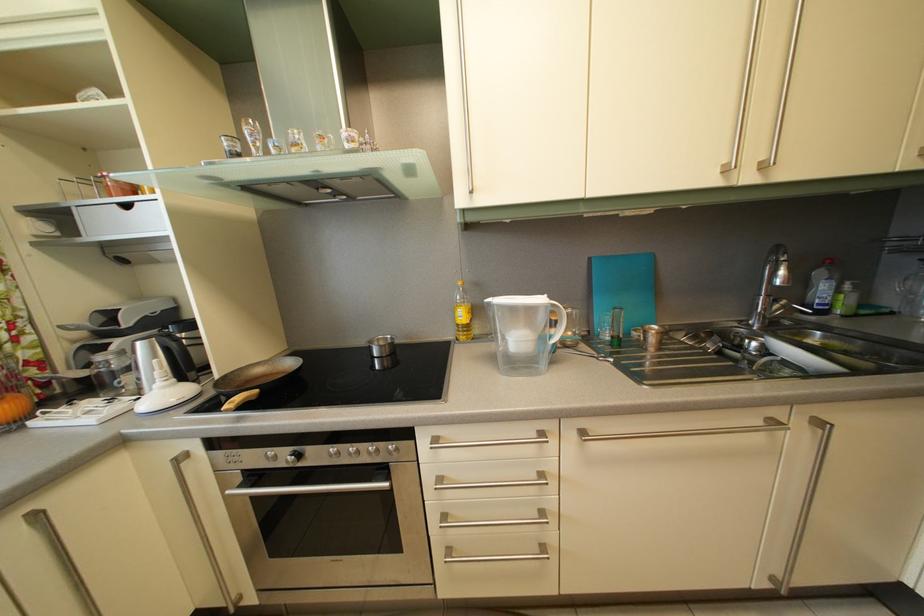
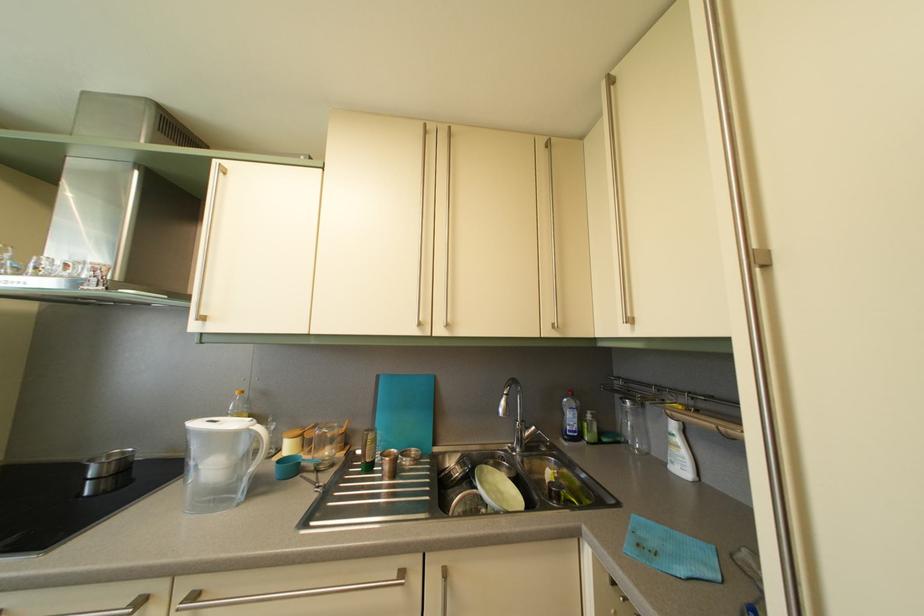
In the second image, find the point that corresponds to [386,347] in the first image.

(118, 463)